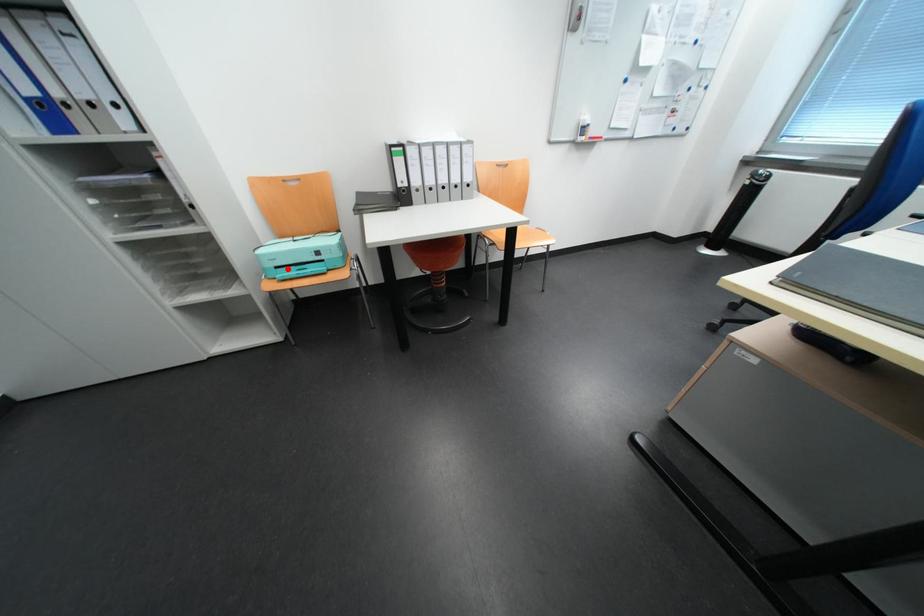
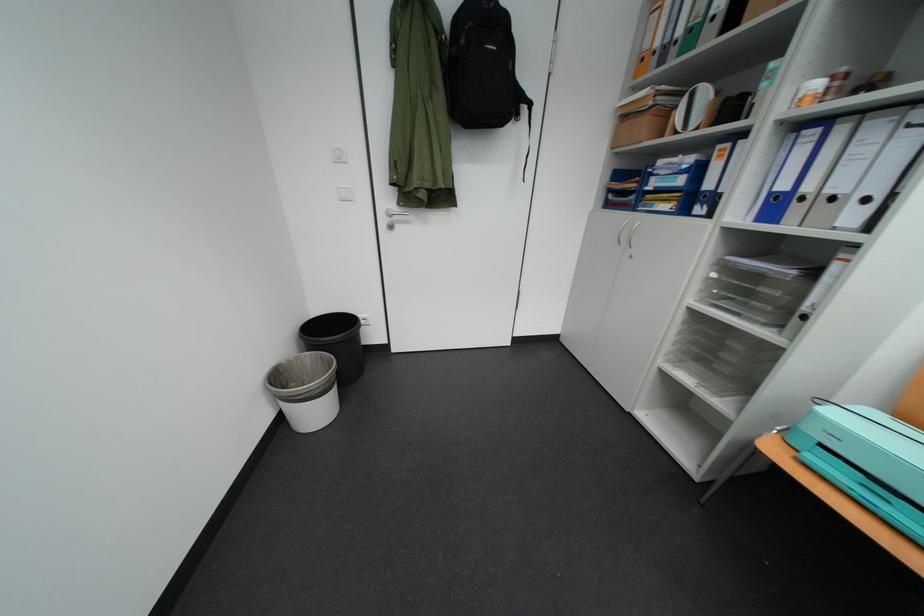
Question: A red point is marked in image1. In image2, is the corresponding 3D point closer to the camera or farther? Reply with the corresponding letter.

Choices:
 (A) The corresponding 3D point is closer.
 (B) The corresponding 3D point is farther.

Answer: (B)